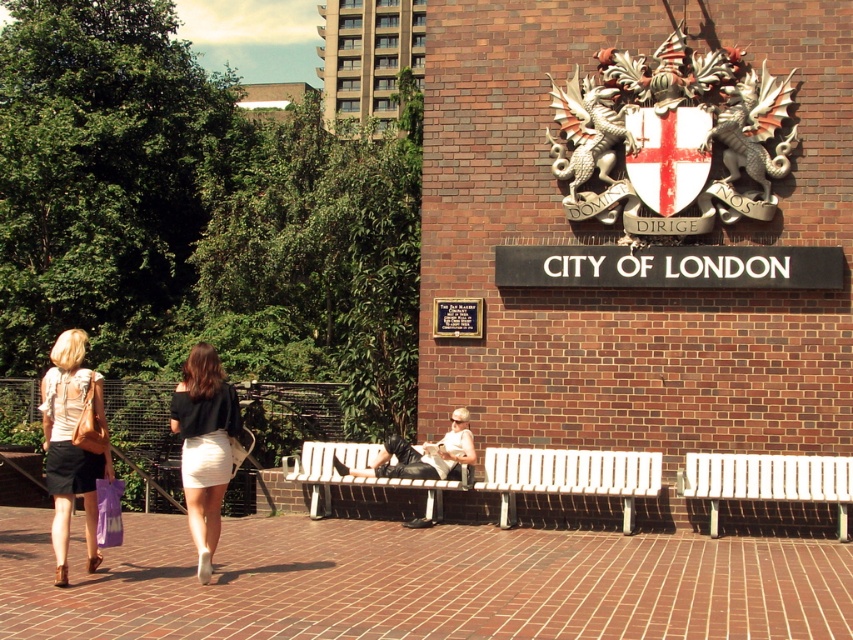
Is point (225, 476) in front of point (703, 464)?

That is True.

Which of these two, white textured skirt at lower left or white plastic bench at right, stands shorter?

With less height is white plastic bench at right.

Does point (204, 378) lie behind point (809, 474)?

No.

Identify the location of white textured skirt at lower left. (204, 445).

How much distance is there between white plastic bench at right and white fabric bag at center?

white plastic bench at right is 5.70 meters away from white fabric bag at center.

Does point (761, 464) lie in front of point (386, 445)?

Yes.

In order to click on white plastic bench at right in this screenshot , I will do `click(767, 481)`.

The width and height of the screenshot is (853, 640). In order to click on white plastic bench at right in this screenshot , I will do `click(767, 481)`.

From the picture: Between white wooden bench at center and purple fabric shopping bag at lower left, which one is positioned lower?

white wooden bench at center

Locate an element on the screen. This screenshot has width=853, height=640. white wooden bench at center is located at coordinates (570, 476).

The height and width of the screenshot is (640, 853). What do you see at coordinates (570, 476) in the screenshot?
I see `white wooden bench at center` at bounding box center [570, 476].

The width and height of the screenshot is (853, 640). In order to click on white wooden bench at center in this screenshot , I will do `click(570, 476)`.